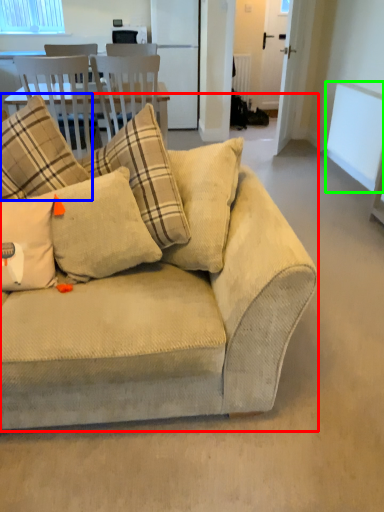
Question: Considering the real-world distances, which object is farthest from studio couch (highlighted by a red box)? pillow (highlighted by a blue box) or window screen (highlighted by a green box)?

Choices:
 (A) pillow
 (B) window screen

Answer: (B)